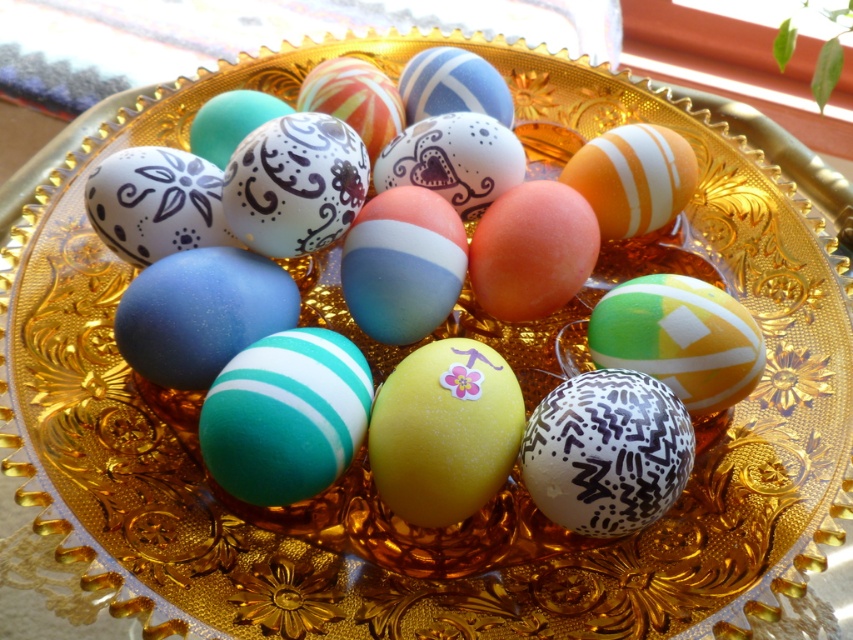
Is matte green and white striped egg at center closer to the viewer compared to orange matte egg at center?

Yes, it is in front of orange matte egg at center.

Is point (654, 326) farther from viewer compared to point (637, 225)?

No, (654, 326) is closer to viewer.

Between point (641, 326) and point (637, 180), which one is positioned behind?

Positioned behind is point (637, 180).

This screenshot has width=853, height=640. In order to click on matte green and white striped egg at center in this screenshot , I will do `click(679, 339)`.

Who is positioned more to the right, yellow matte egg at center or orange matte egg at center?

From the viewer's perspective, orange matte egg at center appears more on the right side.

Does point (492, 396) lie in front of point (605, 164)?

Yes, it is in front of point (605, 164).

Between point (395, 481) and point (665, 160), which one is positioned behind?

The point (665, 160) is behind.

Locate an element on the screen. yellow matte egg at center is located at coordinates (444, 432).

Is point (386, 449) behind point (541, 256)?

No, (386, 449) is closer to viewer.

Between yellow matte egg at center and matte orange egg at center, which one has less height?

matte orange egg at center is shorter.

Where is `yellow matte egg at center`? The image size is (853, 640). yellow matte egg at center is located at coordinates (444, 432).

This screenshot has width=853, height=640. Find the location of `yellow matte egg at center`. yellow matte egg at center is located at coordinates (444, 432).